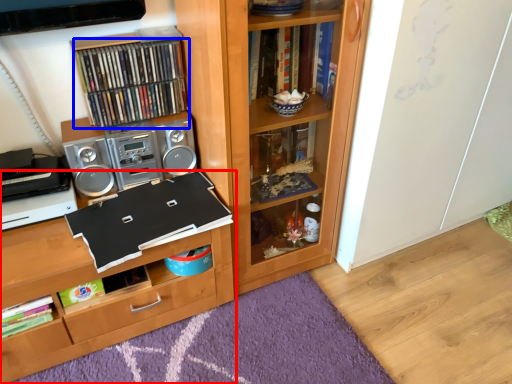
Question: Which point is closer to the camera, shelf (highlighted by a red box) or book (highlighted by a blue box)?

Choices:
 (A) shelf
 (B) book

Answer: (A)